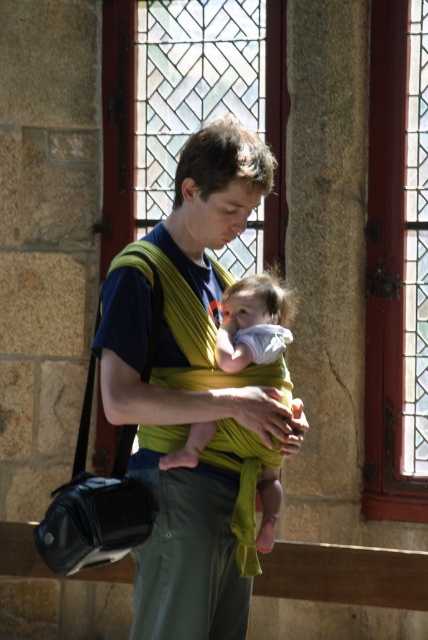
Can you confirm if green fabric baby carrier at center is positioned below soft white cloth at center?

Correct, green fabric baby carrier at center is located below soft white cloth at center.

Can you confirm if green fabric baby carrier at center is bigger than soft white cloth at center?

Indeed, green fabric baby carrier at center has a larger size compared to soft white cloth at center.

Which is behind, point (166, 401) or point (279, 304)?

Positioned behind is point (279, 304).

Where is `green fabric baby carrier at center`? The height and width of the screenshot is (640, 428). green fabric baby carrier at center is located at coordinates (189, 554).